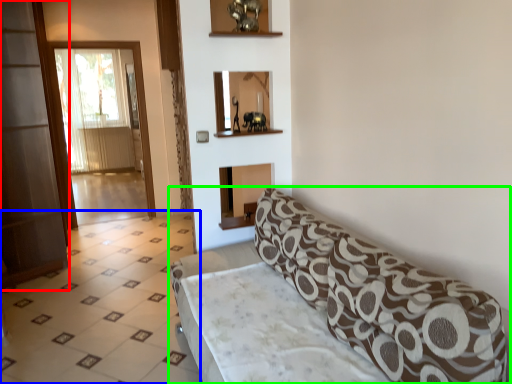
Question: Which object is positioned farthest from screen door (highlighted by a red box)? Select from tile (highlighted by a blue box) and studio couch (highlighted by a green box).

Choices:
 (A) tile
 (B) studio couch

Answer: (B)